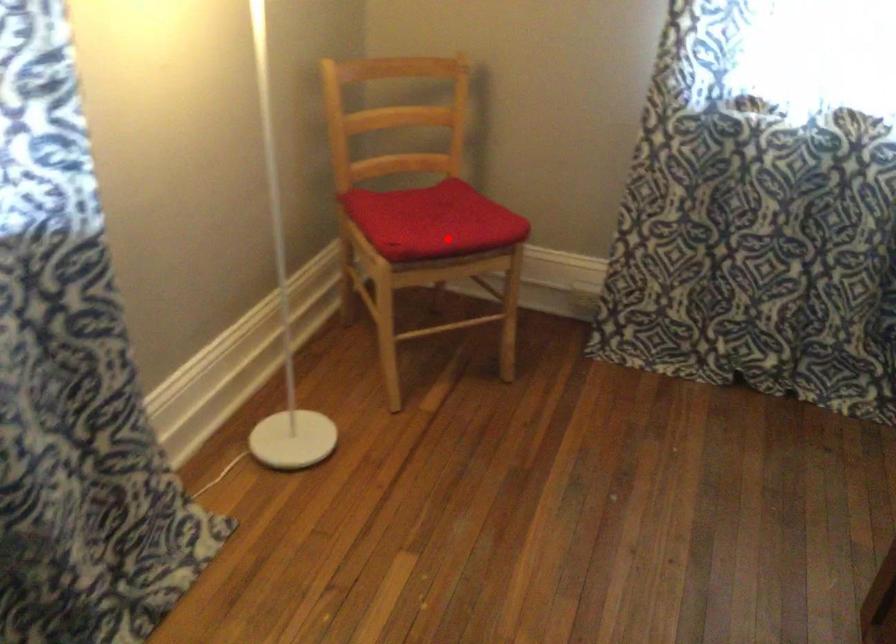
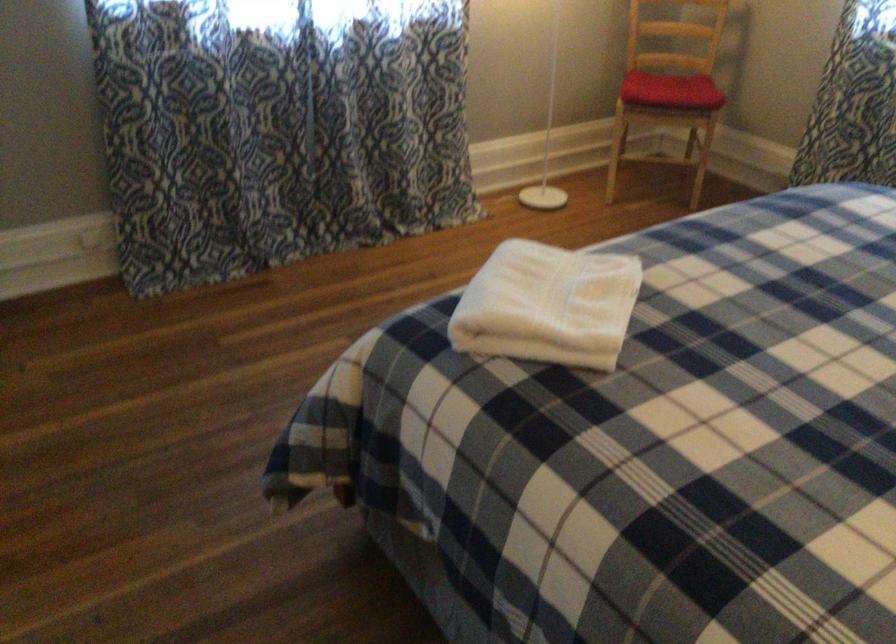
Question: I am providing you with two images of the same scene from different viewpoints. A red point is shown in image1. For the corresponding object point in image2, is it positioned nearer or farther from the camera?

Choices:
 (A) Nearer
 (B) Farther

Answer: (B)